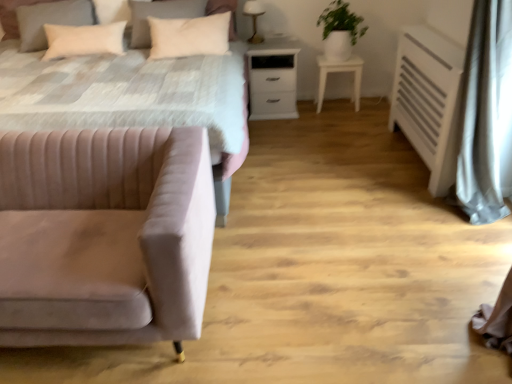
Where is `vacant space to the right of velvet pink couch at lower left`? This screenshot has height=384, width=512. vacant space to the right of velvet pink couch at lower left is located at coordinates 298,282.